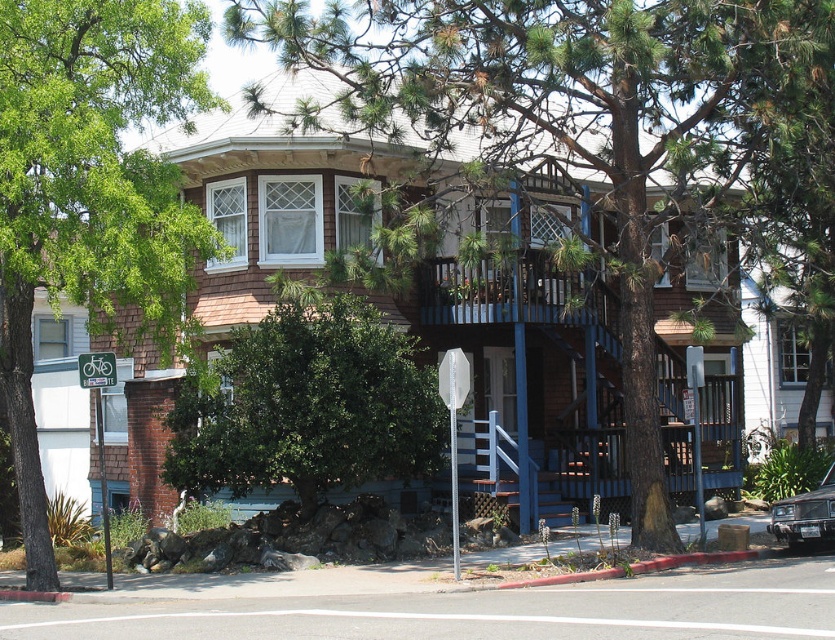
Between point (44, 257) and point (777, 506), which one is positioned in front?

Point (777, 506) is in front.

This screenshot has height=640, width=835. What do you see at coordinates (89, 189) in the screenshot?
I see `green leafy tree at upper left` at bounding box center [89, 189].

Does point (102, 170) come closer to viewer compared to point (785, 500)?

Yes, point (102, 170) is in front of point (785, 500).

Image resolution: width=835 pixels, height=640 pixels. In order to click on green leafy tree at upper left in this screenshot , I will do `click(89, 189)`.

Does green textured tree at center appear on the left side of metallic bicycle sign at upper left?

In fact, green textured tree at center is to the right of metallic bicycle sign at upper left.

Is point (530, 125) farther from viewer compared to point (114, 356)?

Yes, point (530, 125) is farther from viewer.

Is point (802, 140) in front of point (97, 355)?

No, (802, 140) is behind (97, 355).

This screenshot has width=835, height=640. Identify the location of green textured tree at center. (601, 129).

Does metallic silver car at lower right appear on the right side of metallic bicycle sign at upper left?

Yes, metallic silver car at lower right is to the right of metallic bicycle sign at upper left.

Between point (815, 520) and point (90, 378), which one is positioned in front?

Point (90, 378) is in front.

Image resolution: width=835 pixels, height=640 pixels. Identify the location of metallic silver car at lower right. [x=805, y=515].